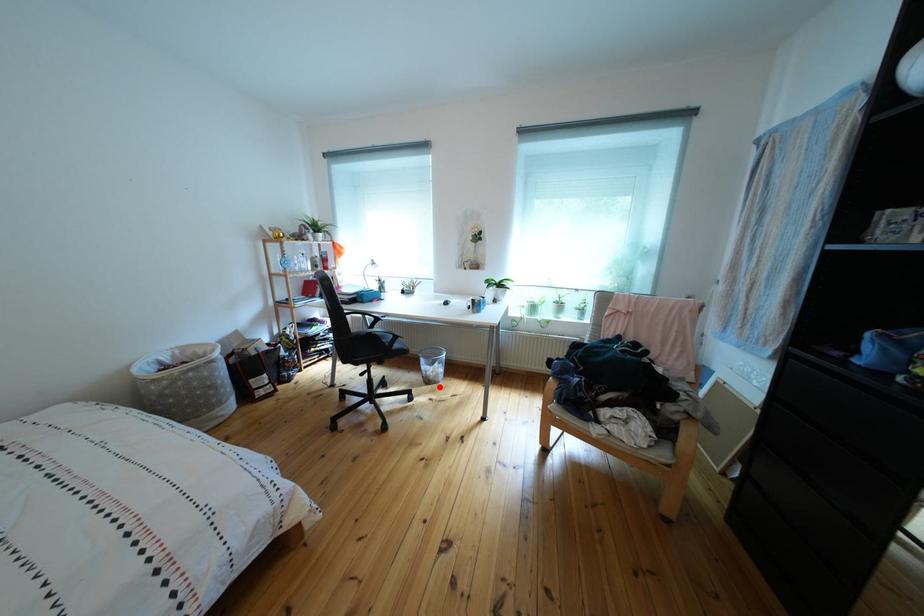
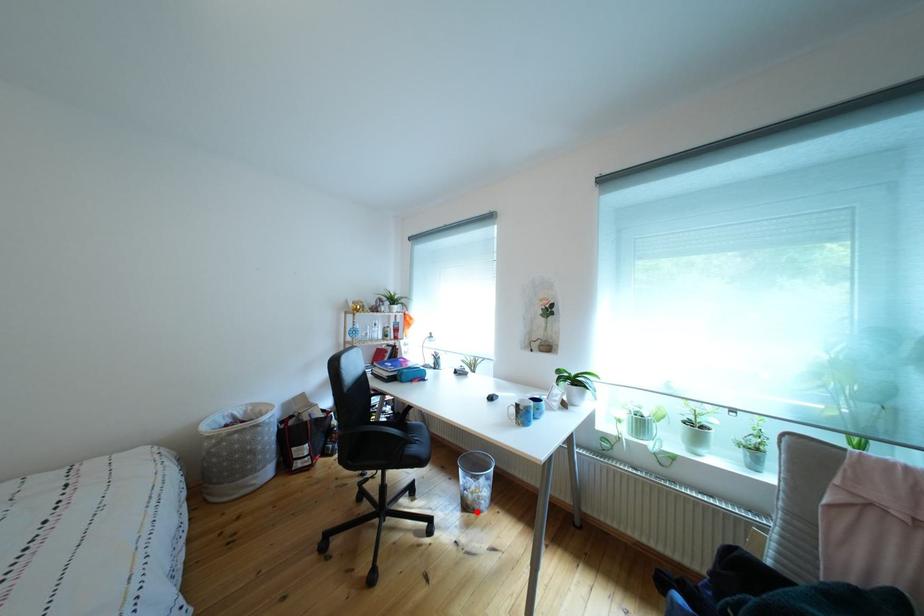
I am providing you with two images of the same scene from different viewpoints. A red point is marked on the first image and another point is marked on the second image. Is the marked point in image1 the same physical position as the marked point in image2?

Yes